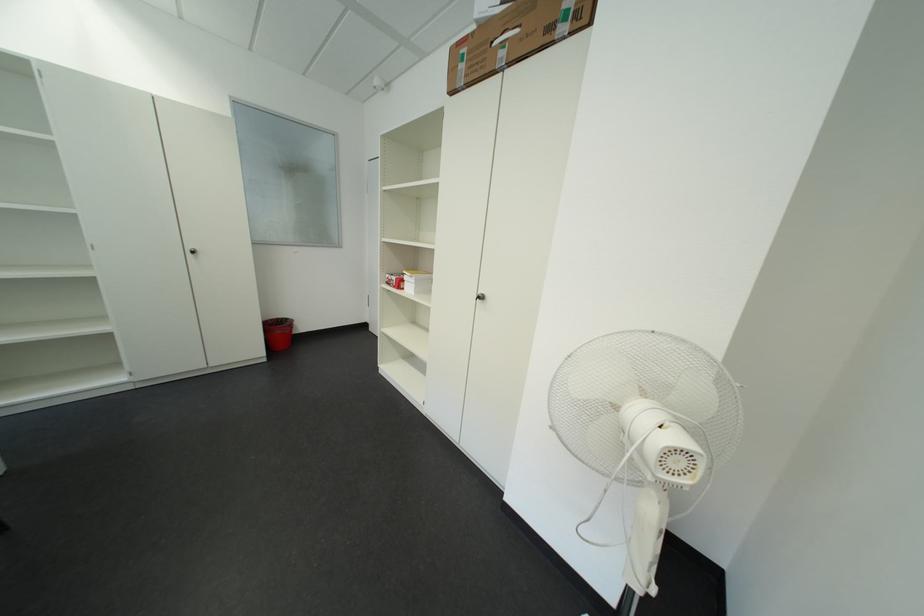
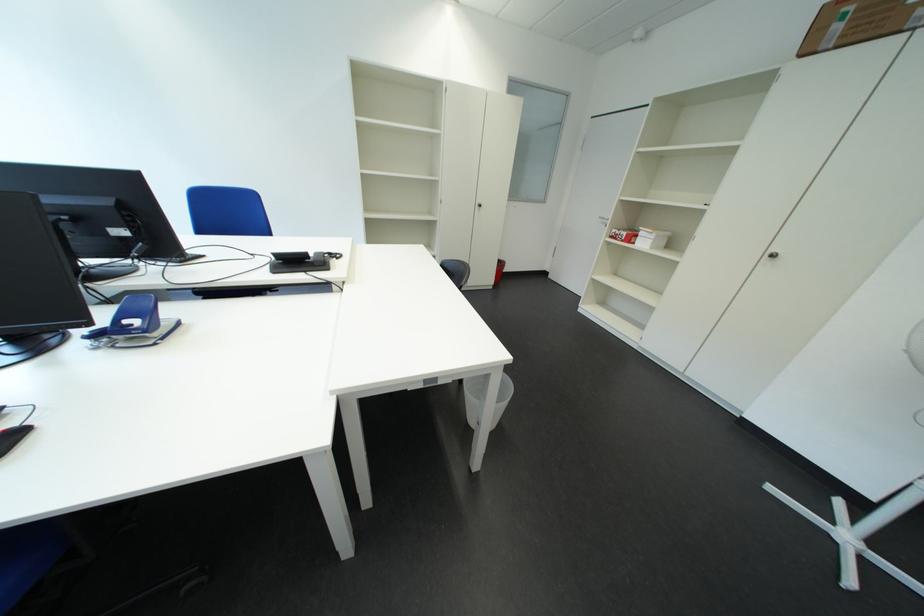
Where in the second image is the point corresponding to pixel 475 70 from the first image?

(849, 30)